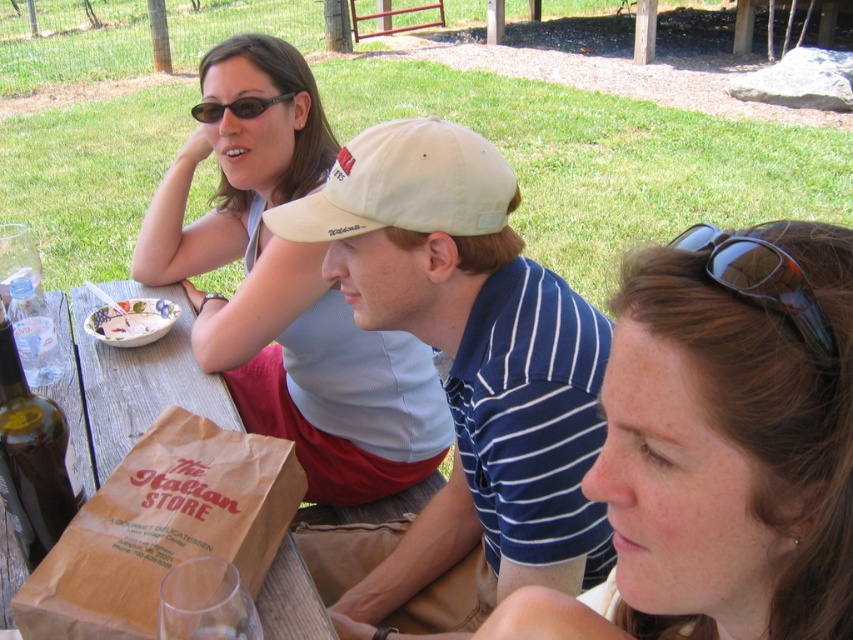
You are a photographer trying to capture a closeup of the matte brown hair at center and the white cotton cap at center. Which object would you need to adjust your camera lens to focus on first if you want to ensure both are in focus, considering their sizes?

The matte brown hair at center is thinner than the white cotton cap at center, so you should focus on the thinner matte brown hair at center first to ensure both are in focus.